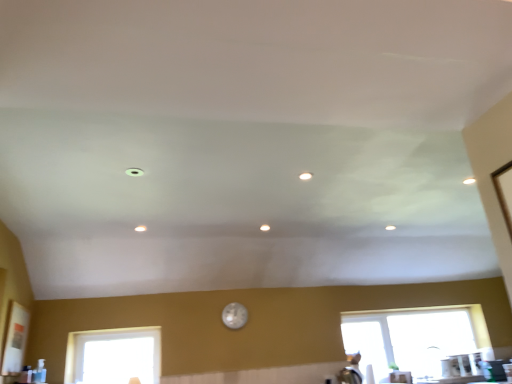
Question: Is transparent glass window at lower left, which appears as the first window when viewed from the left, taller than transparent glass window at lower right, the 2th window when ordered from left to right?

Choices:
 (A) yes
 (B) no

Answer: (B)

Question: Is the position of transparent glass window at lower left, which is the 2th window from back to front, less distant than that of transparent glass window at lower right, the first window in the back-to-front sequence?

Choices:
 (A) no
 (B) yes

Answer: (B)

Question: Is transparent glass window at lower left, which appears as the first window when viewed from the left, completely or partially outside of transparent glass window at lower right, which is the second window from front to back?

Choices:
 (A) yes
 (B) no

Answer: (A)

Question: Is transparent glass window at lower left, which is the 2th window from back to front, not close to transparent glass window at lower right, the 2th window when ordered from left to right?

Choices:
 (A) no
 (B) yes

Answer: (B)

Question: Considering the relative sizes of transparent glass window at lower left, which appears as the first window when viewed from the left, and transparent glass window at lower right, the first window in the back-to-front sequence, in the image provided, is transparent glass window at lower left, which appears as the first window when viewed from the left, wider than transparent glass window at lower right, the first window in the back-to-front sequence,?

Choices:
 (A) yes
 (B) no

Answer: (A)

Question: Considering the relative sizes of transparent glass window at lower left, which is the 2th window from back to front, and transparent glass window at lower right, the first window in the back-to-front sequence, in the image provided, is transparent glass window at lower left, which is the 2th window from back to front, thinner than transparent glass window at lower right, the first window in the back-to-front sequence,?

Choices:
 (A) no
 (B) yes

Answer: (A)

Question: Considering the relative sizes of pearl-like glass clock at center and transparent glass window at lower left, the second window in the right-to-left sequence, in the image provided, is pearl-like glass clock at center taller than transparent glass window at lower left, the second window in the right-to-left sequence,?

Choices:
 (A) yes
 (B) no

Answer: (B)

Question: Is pearl-like glass clock at center not inside transparent glass window at lower left, the first window when ordered from front to back?

Choices:
 (A) no
 (B) yes

Answer: (B)

Question: From a real-world perspective, is pearl-like glass clock at center positioned over transparent glass window at lower left, the second window in the right-to-left sequence, based on gravity?

Choices:
 (A) no
 (B) yes

Answer: (B)

Question: Is pearl-like glass clock at center positioned in front of transparent glass window at lower left, the first window when ordered from front to back?

Choices:
 (A) yes
 (B) no

Answer: (B)

Question: Is pearl-like glass clock at center at the right side of transparent glass window at lower left, which appears as the first window when viewed from the left?

Choices:
 (A) yes
 (B) no

Answer: (A)

Question: From the image's perspective, is pearl-like glass clock at center on transparent glass window at lower left, the first window when ordered from front to back?

Choices:
 (A) yes
 (B) no

Answer: (A)

Question: From the image's perspective, would you say transparent glass window at lower right, which is the second window from front to back, is shown under transparent glass window at lower left, the first window when ordered from front to back?

Choices:
 (A) yes
 (B) no

Answer: (A)